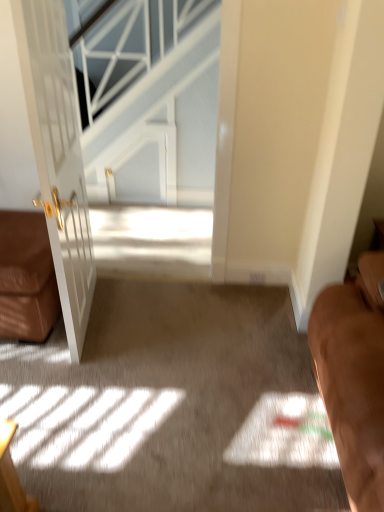
What do you see at coordinates (128, 46) in the screenshot? This screenshot has width=384, height=512. I see `white textured glass at upper center` at bounding box center [128, 46].

What is the approximate width of white glossy door at left?

The width of white glossy door at left is 3.83 inches.

Locate an element on the screen. Image resolution: width=384 pixels, height=512 pixels. white textured glass at upper center is located at coordinates (128, 46).

Is brown leather couch at left to the left of white glossy door at left from the viewer's perspective?

Yes, brown leather couch at left is to the left of white glossy door at left.

Choose the correct answer: Is brown leather couch at left inside white glossy door at left or outside it?

brown leather couch at left lies outside white glossy door at left.

Looking at this image, from the image's perspective, is brown leather couch at left positioned above or below white glossy door at left?

Based on their image positions, brown leather couch at left is located beneath white glossy door at left.

From the image's perspective, is white textured glass at upper center above or below brown leather couch at left?

Based on their image positions, white textured glass at upper center is located above brown leather couch at left.

The width and height of the screenshot is (384, 512). I want to click on furniture directly beneath the white textured glass at upper center (from a real-world perspective), so click(x=26, y=277).

Is white textured glass at upper center shorter than brown leather couch at left?

No, white textured glass at upper center is not shorter than brown leather couch at left.

Consider the image. From a real-world perspective, between white textured glass at upper center and brown leather couch at left, who is vertically lower?

brown leather couch at left, from a real-world perspective.

In terms of width, does white textured glass at upper center look wider or thinner when compared to white glossy door at left?

Clearly, white textured glass at upper center has more width compared to white glossy door at left.

From a real-world perspective, is white textured glass at upper center located higher than white glossy door at left?

Indeed, from a real-world perspective, white textured glass at upper center stands above white glossy door at left.

From the picture: Is white textured glass at upper center completely or partially outside of white glossy door at left?

Yes.

Is white glossy door at left at the back of white textured glass at upper center?

No, white textured glass at upper center is not facing the opposite direction of white glossy door at left.

Which is behind, white glossy door at left or brown leather couch at left?

Positioned behind is brown leather couch at left.

From a real-world perspective, between white glossy door at left and brown leather couch at left, who is vertically higher?

From a 3D spatial view, white glossy door at left is above.

What's the angular difference between white glossy door at left and brown leather couch at left's facing directions?

There is a 101-degree angle between the facing directions of white glossy door at left and brown leather couch at left.

Is white glossy door at left next to white textured glass at upper center?

There is a gap between white glossy door at left and white textured glass at upper center.

From their relative heights in the image, would you say white glossy door at left is taller or shorter than white textured glass at upper center?

In the image, white glossy door at left appears to be shorter than white textured glass at upper center.

Locate an element on the screen. Image resolution: width=384 pixels, height=512 pixels. window above the white glossy door at left (from the image's perspective) is located at coordinates (128, 46).

From the image's perspective, is white glossy door at left above or below white textured glass at upper center?

From the image's perspective, white glossy door at left appears below white textured glass at upper center.

From the image's perspective, is brown leather couch at left over white textured glass at upper center?

No, from the image's perspective, brown leather couch at left is not on top of white textured glass at upper center.

Consider the image. Considering the relative sizes of brown leather couch at left and white textured glass at upper center in the image provided, is brown leather couch at left thinner than white textured glass at upper center?

No, brown leather couch at left is not thinner than white textured glass at upper center.

Identify the location of window above the brown leather couch at left (from the image's perspective). click(x=128, y=46).

Measure the distance from brown leather couch at left to white textured glass at upper center.

6.36 feet.

Find the location of a particular element. The width and height of the screenshot is (384, 512). furniture on the left of white glossy door at left is located at coordinates (26, 277).

Find the location of a particular element. Image resolution: width=384 pixels, height=512 pixels. furniture below the white textured glass at upper center (from the image's perspective) is located at coordinates (26, 277).

Considering their positions, is white textured glass at upper center positioned further to white glossy door at left than brown leather couch at left?

The object further to white glossy door at left is white textured glass at upper center.

When comparing their distances from brown leather couch at left, does white textured glass at upper center or white glossy door at left seem closer?

white glossy door at left lies closer to brown leather couch at left than the other object.

From the image, which object appears to be nearer to white glossy door at left, brown leather couch at left or white textured glass at upper center?

brown leather couch at left.

Based on their spatial positions, is white glossy door at left or white textured glass at upper center further from brown leather couch at left?

white textured glass at upper center.

Consider the image. Looking at the image, which one is located further to white textured glass at upper center, white glossy door at left or brown leather couch at left?

Among the two, brown leather couch at left is located further to white textured glass at upper center.

When comparing their distances from white textured glass at upper center, does brown leather couch at left or white glossy door at left seem further?

brown leather couch at left is further to white textured glass at upper center.

Identify the location of furniture between white glossy door at left and white textured glass at upper center along the z-axis. This screenshot has width=384, height=512. (26, 277).